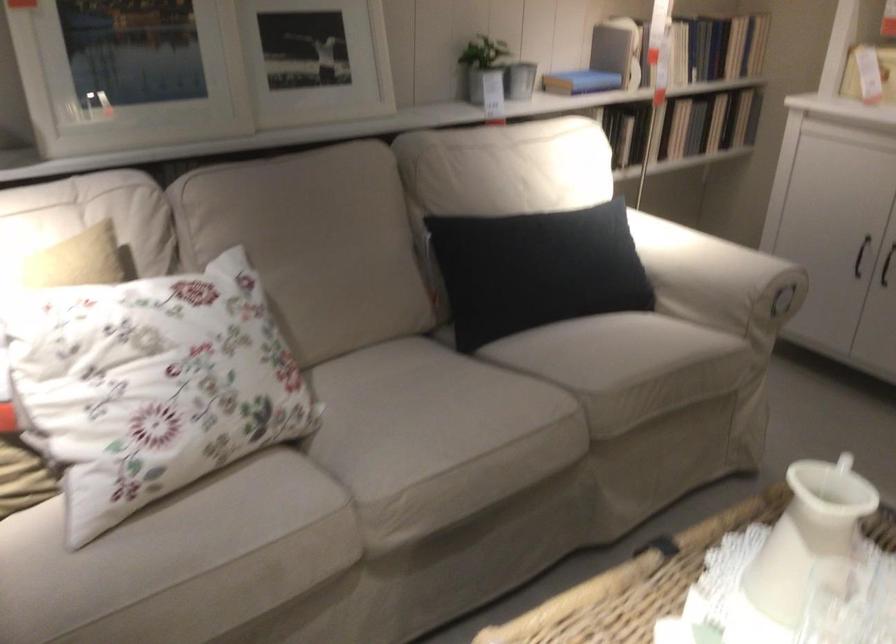
Image resolution: width=896 pixels, height=644 pixels. In order to click on blue book in this screenshot , I will do 580,82.